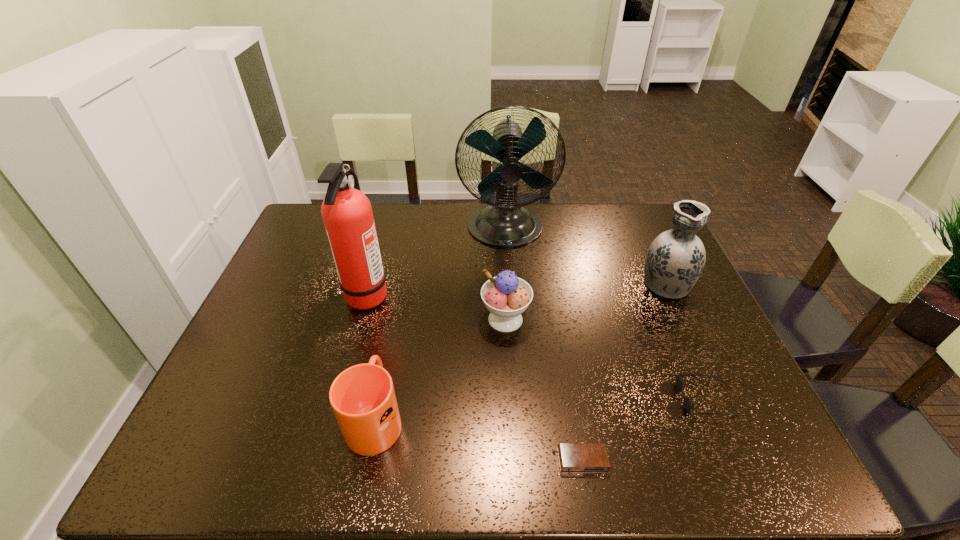
At what (x,y) coordinates should I click in order to perform the action: click on the farthest object. Please return your answer as a coordinate pair (x, y). Looking at the image, I should click on (505, 223).

Find the location of a particular element. This screenshot has height=540, width=960. fire extinguisher is located at coordinates (347, 214).

Find the location of a particular element. The height and width of the screenshot is (540, 960). vase is located at coordinates (676, 258).

Find the location of `icecream`. icecream is located at coordinates (506, 296).

Image resolution: width=960 pixels, height=540 pixels. Identify the location of mug. (363, 399).

Locate an element on the screen. The width and height of the screenshot is (960, 540). sunglasses is located at coordinates (688, 403).

At what (x,y) coordinates should I click in order to perform the action: click on the shortest object. Please return your answer as a coordinate pair (x, y). The width and height of the screenshot is (960, 540). Looking at the image, I should click on (573, 457).

Locate an element on the screen. vacant space located on the front-facing side of the farthest object is located at coordinates (509, 272).

Locate an element on the screen. This screenshot has width=960, height=540. free space located on the handle side of the fire extinguisher is located at coordinates tap(522, 294).

Where is `vacant space located with the handle on the side of the fifth shortest object`? This screenshot has width=960, height=540. vacant space located with the handle on the side of the fifth shortest object is located at coordinates (637, 223).